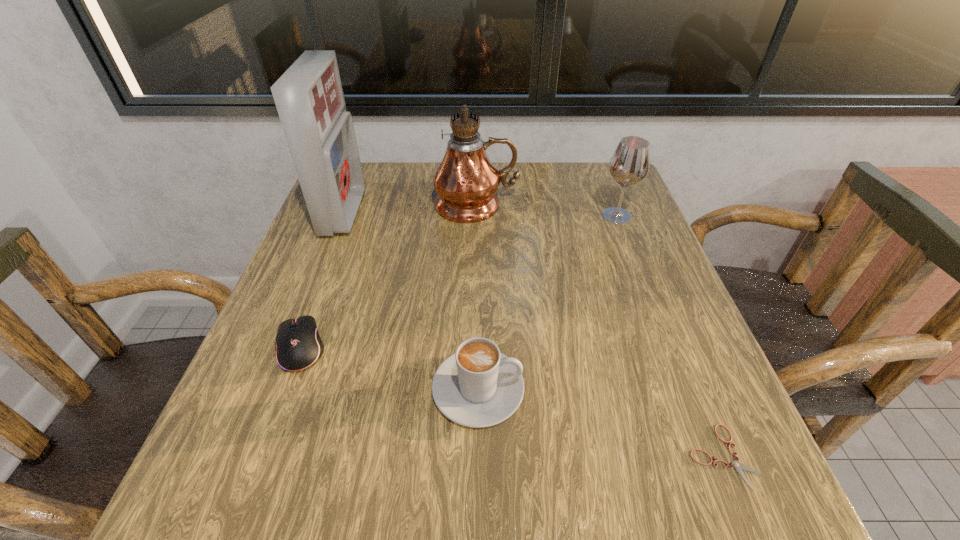
Identify the location of object at the far left corner. (309, 98).

This screenshot has height=540, width=960. Find the location of `object that is at the far right corner`. object that is at the far right corner is located at coordinates (630, 162).

Locate an element on the screen. The height and width of the screenshot is (540, 960). object that is at the near right corner is located at coordinates (738, 466).

Locate an element on the screen. Image resolution: width=960 pixels, height=540 pixels. vacant space at the far edge of the desktop is located at coordinates (400, 212).

Image resolution: width=960 pixels, height=540 pixels. In order to click on free spot at the near edge of the desktop in this screenshot , I will do `click(553, 476)`.

Where is `vacant area at the left edge of the desktop`? This screenshot has height=540, width=960. vacant area at the left edge of the desktop is located at coordinates (360, 220).

You are a GUI agent. You are given a task and a screenshot of the screen. Output one action in this format:
    pyautogui.click(x=<x>, y=<y>)
    Task: Click on the free space at the right edge of the desktop
    Image resolution: width=960 pixels, height=540 pixels.
    Given the screenshot: What is the action you would take?
    pyautogui.click(x=673, y=288)

Locate an element on the screen. This screenshot has width=960, height=540. free space at the far left corner of the desktop is located at coordinates (388, 213).

Find the location of a particular element. vacant space at the far right corner of the desktop is located at coordinates (575, 212).

The image size is (960, 540). Find the location of `free space between the cappuccino and the third tallest object`. free space between the cappuccino and the third tallest object is located at coordinates (547, 302).